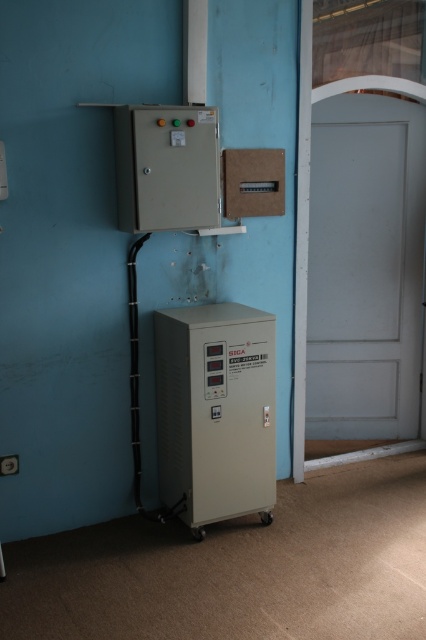
Question: Which of these objects is positioned farthest from the gray matte power supply at center?

Choices:
 (A) beige plastic control panel at upper center
 (B) white matte door at right

Answer: (B)

Question: Does white matte door at right have a larger size compared to gray matte power supply at center?

Choices:
 (A) no
 (B) yes

Answer: (B)

Question: Does white matte door at right appear on the right side of beige plastic control panel at upper center?

Choices:
 (A) no
 (B) yes

Answer: (B)

Question: Does white matte door at right have a smaller size compared to gray matte power supply at center?

Choices:
 (A) no
 (B) yes

Answer: (A)

Question: Which point is closer to the camera?

Choices:
 (A) beige plastic control panel at upper center
 (B) gray matte power supply at center
 (C) white matte door at right

Answer: (A)

Question: Among these points, which one is farthest from the camera?

Choices:
 (A) (201, 412)
 (B) (409, 173)
 (C) (199, 182)

Answer: (B)